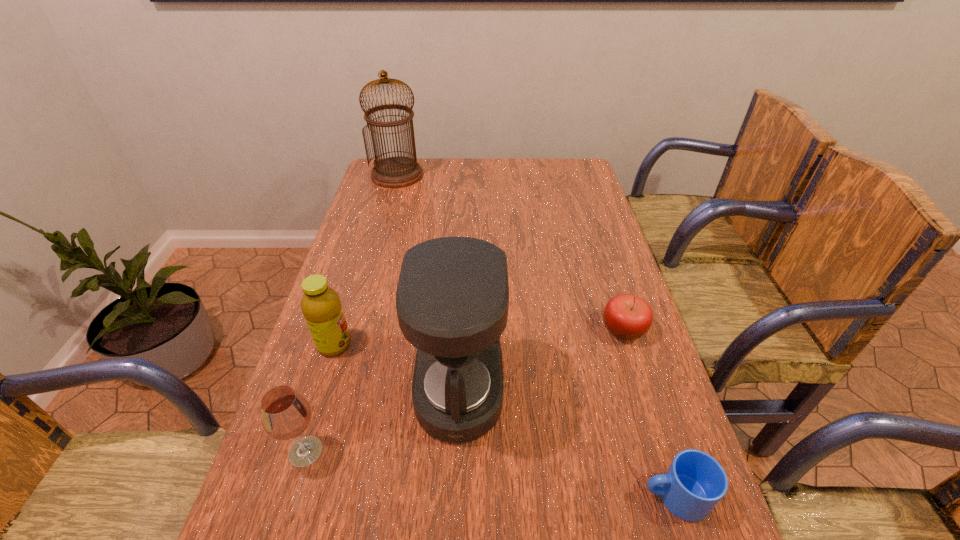
Where is `object at the far left corner`? object at the far left corner is located at coordinates (394, 172).

In the image, there is a desktop. Where is `vacant space at the far edge`? vacant space at the far edge is located at coordinates (537, 167).

Locate an element on the screen. The height and width of the screenshot is (540, 960). vacant space at the left edge of the desktop is located at coordinates (288, 453).

The height and width of the screenshot is (540, 960). Find the location of `free region at the right edge of the desktop`. free region at the right edge of the desktop is located at coordinates (609, 231).

Find the location of a particular element. vacant space at the far right corner of the desktop is located at coordinates (564, 160).

Identify the location of vacant area that lies between the farthest object and the fruit juice. (366, 260).

The image size is (960, 540). Identify the location of free spot between the wineglass and the coffee maker. (383, 421).

Where is `unoccupied area between the apple and the birdcage`? The image size is (960, 540). unoccupied area between the apple and the birdcage is located at coordinates (511, 253).

Find the location of a particular element. free spot between the coffee maker and the wineglass is located at coordinates (383, 421).

The width and height of the screenshot is (960, 540). In order to click on free space between the fifth tallest object and the coffee maker in this screenshot , I will do `click(541, 360)`.